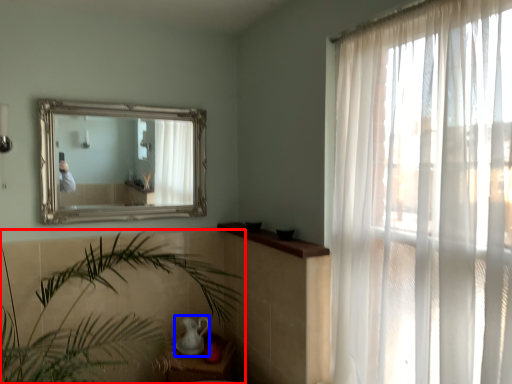
Question: Among these objects, which one is farthest to the camera, houseplant (highlighted by a red box) or tea pot (highlighted by a blue box)?

Choices:
 (A) houseplant
 (B) tea pot

Answer: (B)